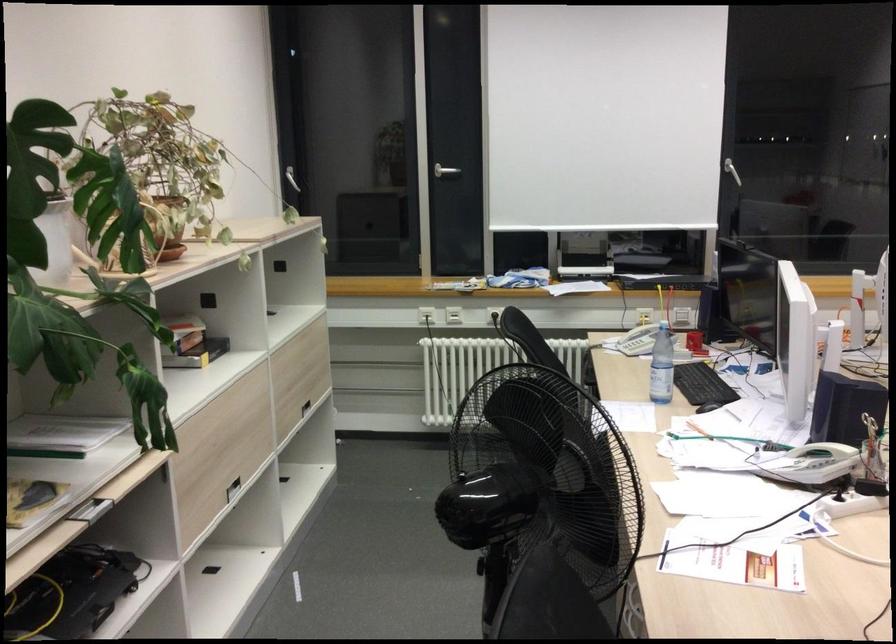
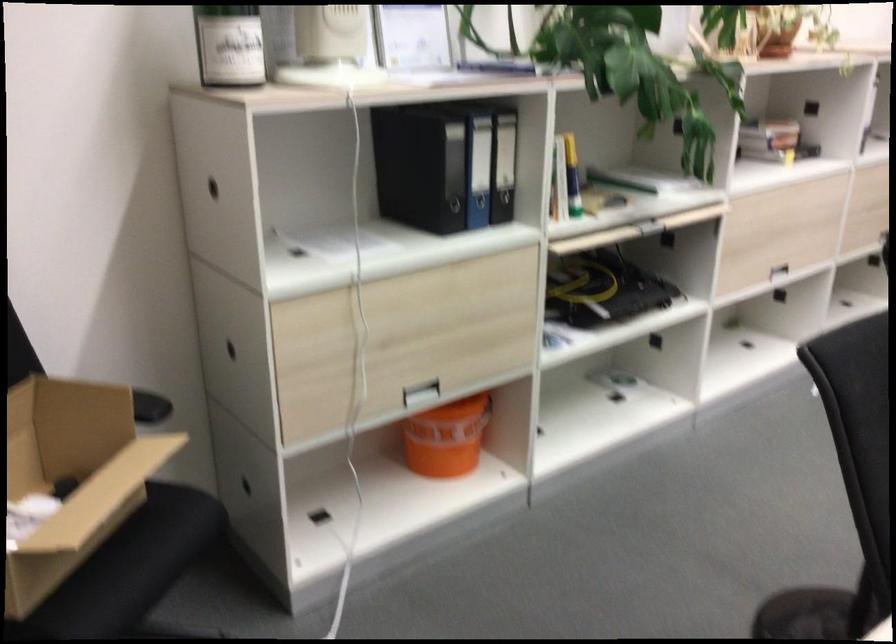
Question: The camera is either moving clockwise (left) or counter-clockwise (right) around the object. The first image is from the beginning of the video and the second image is from the end. Is the camera moving left or right when shooting the video?

Choices:
 (A) Left
 (B) Right

Answer: (B)